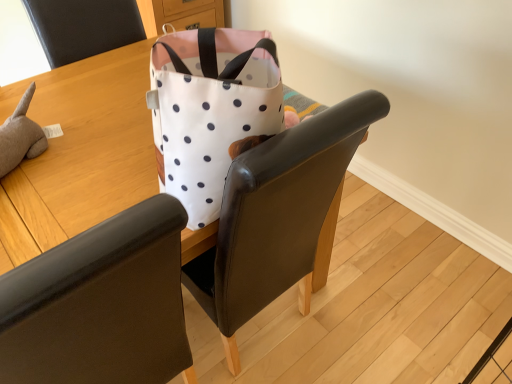
Question: Is white fabric chair at upper center, arranged as the 2th chair when viewed from the top, positioned in front of white fabric bag at upper center?

Choices:
 (A) no
 (B) yes

Answer: (B)

Question: From a real-world perspective, is white fabric chair at upper center, the first chair when ordered from bottom to top, below white fabric bag at upper center?

Choices:
 (A) no
 (B) yes

Answer: (A)

Question: Is white fabric bag at upper center a part of white fabric chair at upper center, the first chair when ordered from bottom to top?

Choices:
 (A) yes
 (B) no

Answer: (B)

Question: Considering the relative sizes of white fabric chair at upper center, arranged as the 2th chair when viewed from the top, and white fabric bag at upper center in the image provided, is white fabric chair at upper center, arranged as the 2th chair when viewed from the top, shorter than white fabric bag at upper center?

Choices:
 (A) yes
 (B) no

Answer: (B)

Question: From the image's perspective, does white fabric chair at upper center, arranged as the 2th chair when viewed from the top, appear higher than white fabric bag at upper center?

Choices:
 (A) yes
 (B) no

Answer: (B)

Question: Considering the relative sizes of white fabric chair at upper center, the first chair when ordered from bottom to top, and white fabric bag at upper center in the image provided, is white fabric chair at upper center, the first chair when ordered from bottom to top, wider than white fabric bag at upper center?

Choices:
 (A) yes
 (B) no

Answer: (B)

Question: Does white fabric bag at upper center have a smaller size compared to white fabric chair at upper center, the first chair when ordered from bottom to top?

Choices:
 (A) no
 (B) yes

Answer: (A)

Question: Is white fabric bag at upper center shorter than white fabric chair at upper center, the first chair when ordered from bottom to top?

Choices:
 (A) yes
 (B) no

Answer: (A)

Question: Does white fabric bag at upper center have a larger size compared to white fabric chair at upper center, arranged as the 2th chair when viewed from the top?

Choices:
 (A) no
 (B) yes

Answer: (B)

Question: Can you confirm if white fabric bag at upper center is thinner than white fabric chair at upper center, arranged as the 2th chair when viewed from the top?

Choices:
 (A) no
 (B) yes

Answer: (A)

Question: Does white fabric bag at upper center turn towards white fabric chair at upper center, the first chair when ordered from bottom to top?

Choices:
 (A) no
 (B) yes

Answer: (B)

Question: Is white fabric bag at upper center oriented away from white fabric chair at upper center, arranged as the 2th chair when viewed from the top?

Choices:
 (A) yes
 (B) no

Answer: (B)

Question: Can we say matte black chair at upper left, which ranks as the 2th chair in bottom-to-top order, lies outside white fabric bag at upper center?

Choices:
 (A) yes
 (B) no

Answer: (A)